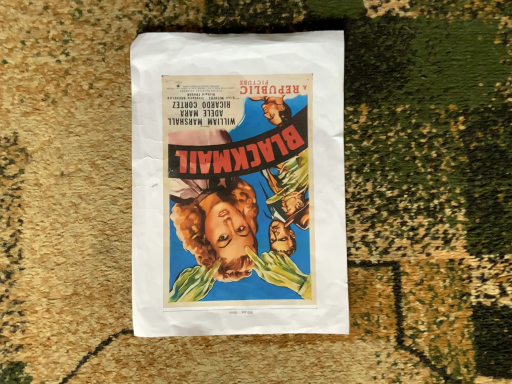
Locate an element on the screen. Image resolution: width=512 pixels, height=384 pixels. vintage paper poster at center is located at coordinates (238, 184).

Measure the distance between point [255,40] and camera.

Point [255,40] is 16.54 inches away from camera.

This screenshot has height=384, width=512. What do you see at coordinates (238, 184) in the screenshot?
I see `vintage paper poster at center` at bounding box center [238, 184].

The height and width of the screenshot is (384, 512). Identify the location of vintage paper poster at center. (238, 184).